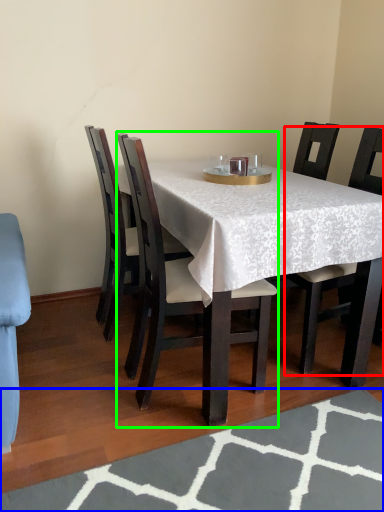
Question: Based on their relative distances, which object is nearer to chair (highlighted by a red box)? Choose from place mat (highlighted by a blue box) and chair (highlighted by a green box).

Choices:
 (A) place mat
 (B) chair

Answer: (B)